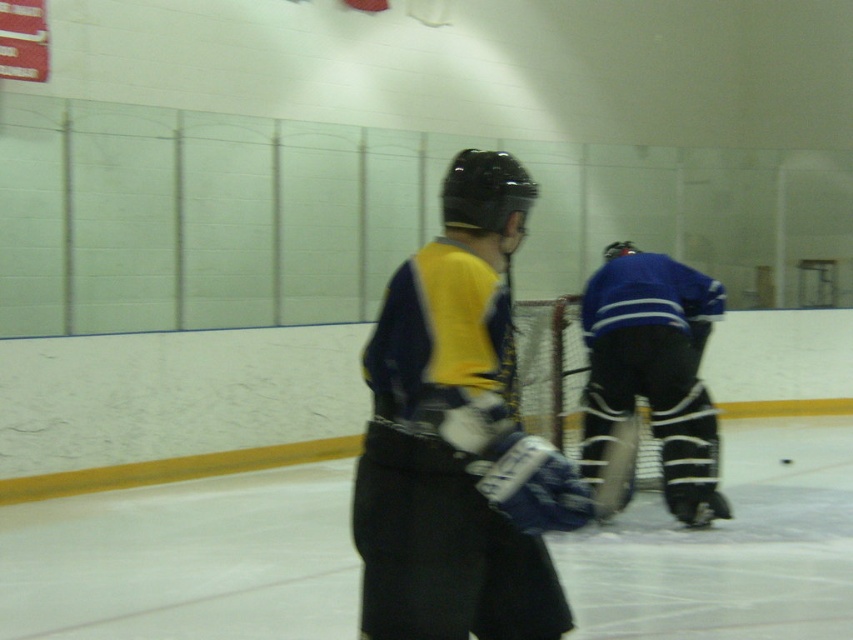
You are standing at the center of the ice rink and see the point marked at coordinates (457, 436). What object is located at that point?

The point at coordinates (457, 436) corresponds to the matte black hockey stick at center.

You are a spectator sitting in the stands and want to take a photo of both the matte black hockey stick at center and the white padded goalie at center. Which one will appear larger in your photo?

The matte black hockey stick at center will appear larger in the photo because it is closer to the viewer than the white padded goalie at center.

You are an ice hockey player standing at the point marked as point (x=433, y=524) on the ice rink. Your coach has asked you to move forward 3 meters towards the goal. Will you be able to reach the goal without moving past the point?

The distance of point (x=433, y=524) from the camera is 2.62 meters. Moving forward 3 meters would take you past the point, so you will not be able to reach the goal without moving past the point.